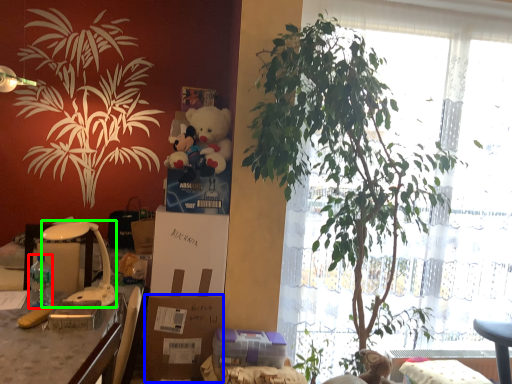
Question: Estimate the real-world distances between objects in this image. Which object is closer to bottle (highlighted by a red box), cardboard box (highlighted by a blue box) or lamp (highlighted by a green box)?

Choices:
 (A) cardboard box
 (B) lamp

Answer: (B)